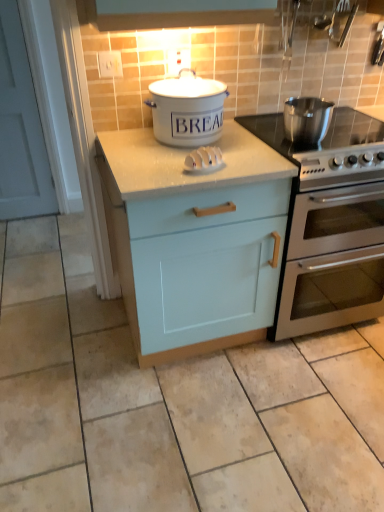
At what (x,y) coordinates should I click in order to perform the action: click on vacant area that is situated to the right of white ceramic bread bin at center, acting as the 1th kitchen appliance starting from the left. Please return your answer as a coordinate pair (x, y). The width and height of the screenshot is (384, 512). Looking at the image, I should click on (248, 144).